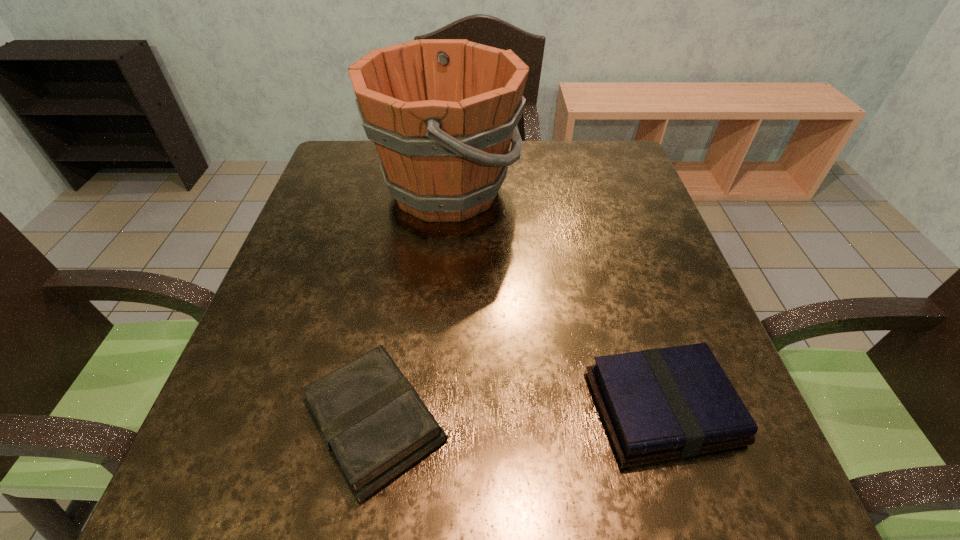
Where is `the second closest object to the left book`? the second closest object to the left book is located at coordinates (x=442, y=113).

Locate which object is the closest to the right book. Please provide its 2D coordinates. Your answer should be formatted as a tuple, i.e. [(x, y)], where the tuple contains the x and y coordinates of a point satisfying the conditions above.

[(372, 421)]

Where is `free spot that satisfies the following two spatial constraints: 1. on the back side of the right book; 2. on the handle side of the farthest object`? This screenshot has height=540, width=960. free spot that satisfies the following two spatial constraints: 1. on the back side of the right book; 2. on the handle side of the farthest object is located at coordinates (594, 191).

Find the location of a particular element. Image resolution: width=960 pixels, height=540 pixels. free space that satisfies the following two spatial constraints: 1. on the handle side of the rightmost object; 2. on the left side of the farthest object is located at coordinates (426, 409).

Find the location of a particular element. vacant space that satisfies the following two spatial constraints: 1. on the handle side of the tallest object; 2. on the back side of the rightmost object is located at coordinates (426, 409).

The height and width of the screenshot is (540, 960). What are the coordinates of `vacant region that satisfies the following two spatial constraints: 1. on the back side of the right book; 2. on the left side of the left book` in the screenshot? It's located at (377, 409).

You are a GUI agent. You are given a task and a screenshot of the screen. Output one action in this format:
    pyautogui.click(x=<x>, y=<y>)
    Task: Click on the blank space that satisfies the following two spatial constraints: 1. on the handle side of the tallest object; 2. on the back side of the rightmost object
    The image size is (960, 540).
    Given the screenshot: What is the action you would take?
    pyautogui.click(x=426, y=409)

The width and height of the screenshot is (960, 540). In order to click on free space that satisfies the following two spatial constraints: 1. on the handle side of the farthest object; 2. on the front side of the left book in this screenshot , I will do `click(425, 422)`.